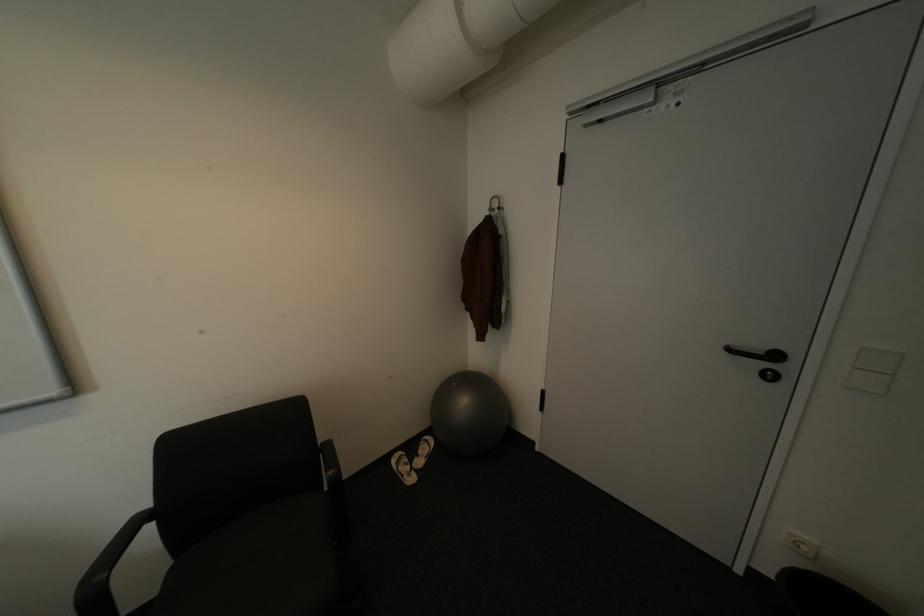
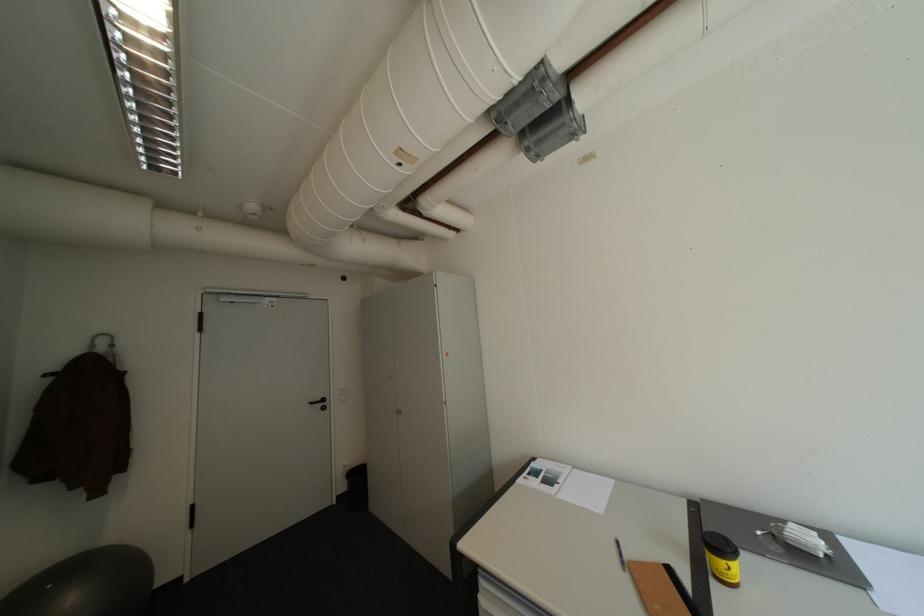
Find the pixel in the second image that matches pixel 464 384 in the first image.

(59, 586)